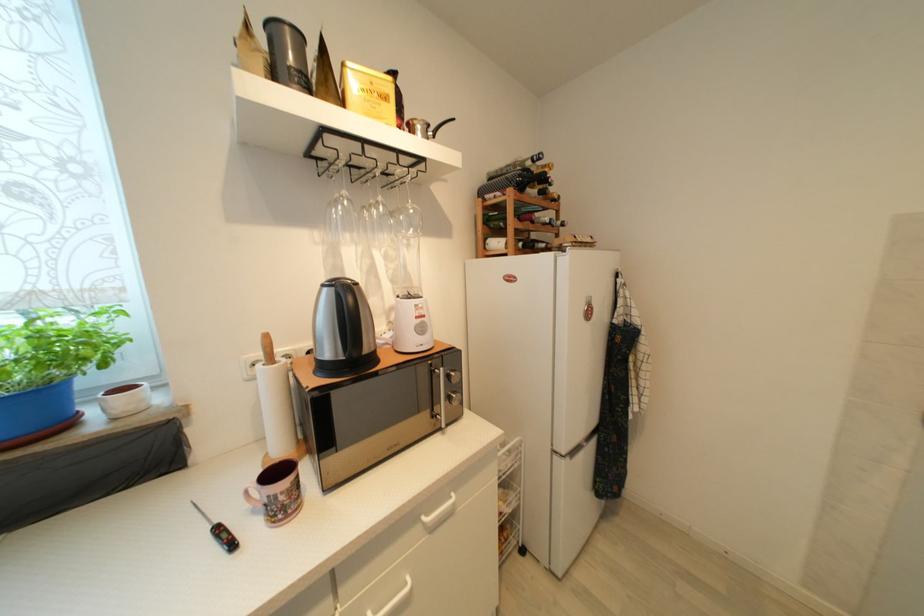
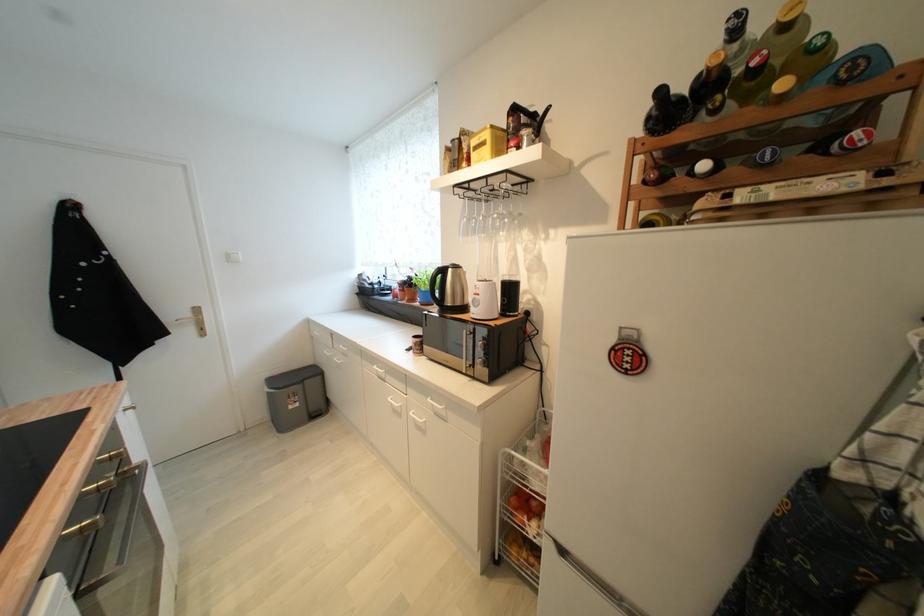
Question: I am providing you with two images of the same scene from different viewpoints. Please identify which objects are invisible in image2.

Choices:
 (A) wine bottle
 (B) trash can pedal
 (C) oven door handle
 (D) none of these

Answer: (D)